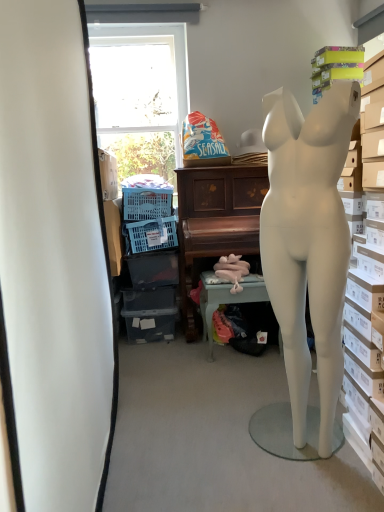
Where is `vacant space situated on the left part of white matte mannequin at right`? vacant space situated on the left part of white matte mannequin at right is located at coordinates click(231, 465).